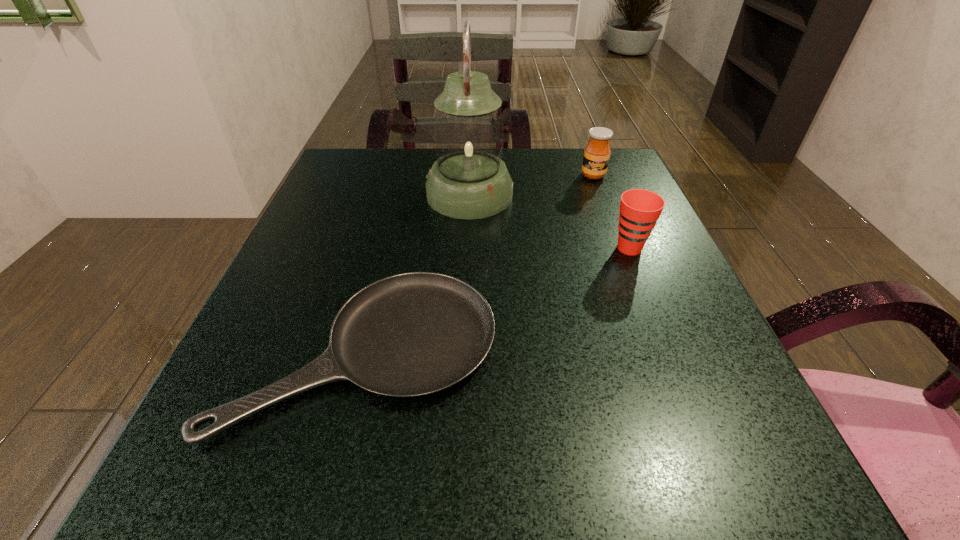
Where is `honey located in the far edge section of the desktop`? honey located in the far edge section of the desktop is located at coordinates (597, 152).

Where is `object that is at the near edge`? The height and width of the screenshot is (540, 960). object that is at the near edge is located at coordinates (412, 334).

The width and height of the screenshot is (960, 540). What are the coordinates of `object at the left edge` in the screenshot? It's located at (412, 334).

The height and width of the screenshot is (540, 960). What are the coordinates of `honey at the right edge` in the screenshot? It's located at (597, 152).

The image size is (960, 540). What are the coordinates of `cup at the right edge` in the screenshot? It's located at (640, 209).

This screenshot has width=960, height=540. What are the coordinates of `object present at the near left corner` in the screenshot? It's located at (412, 334).

At what (x,y) coordinates should I click in order to perform the action: click on object located at the far right corner. Please return your answer as a coordinate pair (x, y). The image size is (960, 540). Looking at the image, I should click on point(597,152).

In the image, there is a desktop. Where is `vacant space at the far edge`? vacant space at the far edge is located at coordinates (518, 197).

In the image, there is a desktop. Where is `free space at the near edge`? free space at the near edge is located at coordinates (362, 453).

In the image, there is a desktop. Where is `free space at the left edge`? The height and width of the screenshot is (540, 960). free space at the left edge is located at coordinates (344, 303).